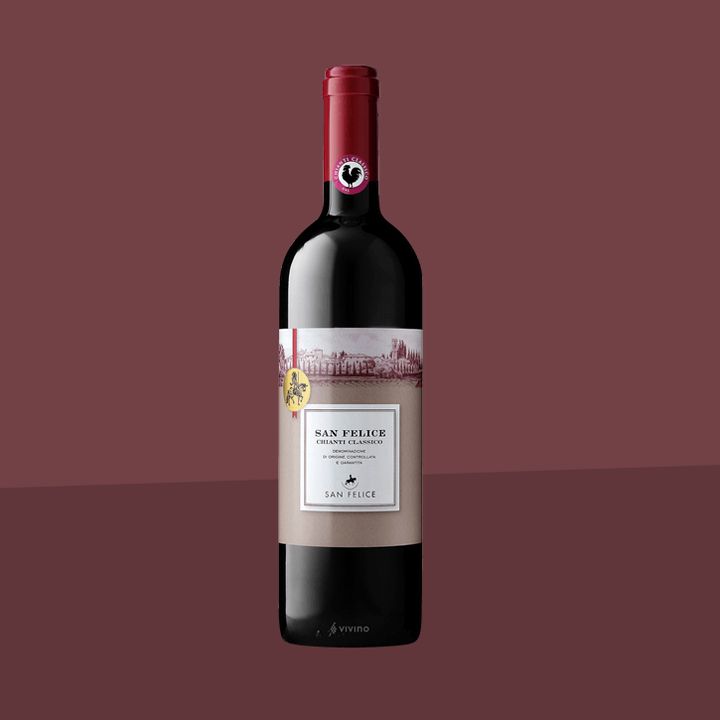
The height and width of the screenshot is (720, 720). In order to click on purple wall in this screenshot , I will do `click(199, 127)`.